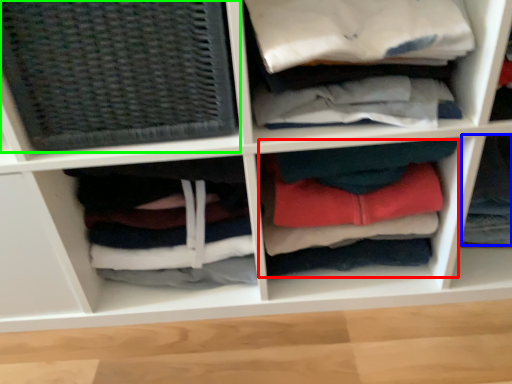
Question: Which object is the closest to the clothing (highlighted by a red box)? Choose among these: clothing (highlighted by a blue box) or basket (highlighted by a green box).

Choices:
 (A) clothing
 (B) basket

Answer: (A)